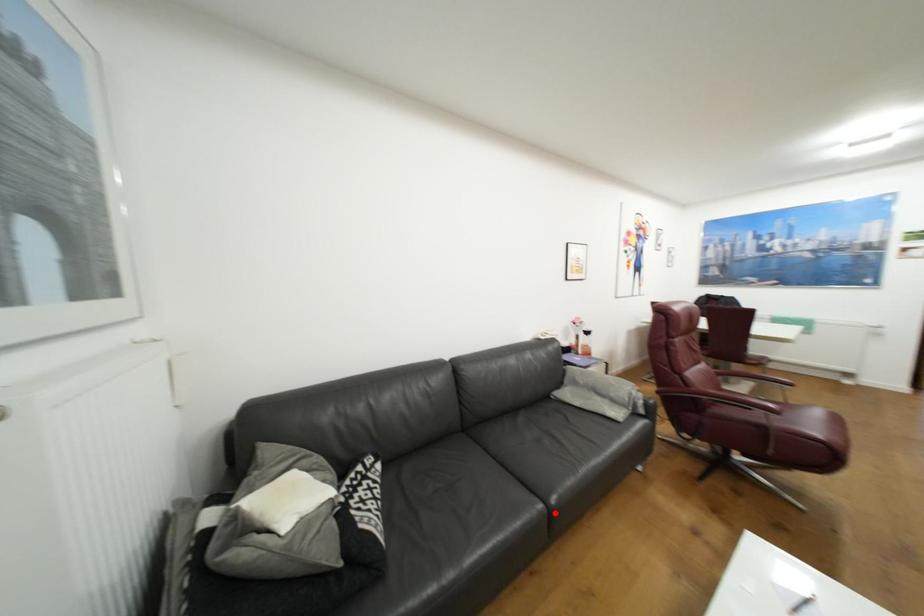
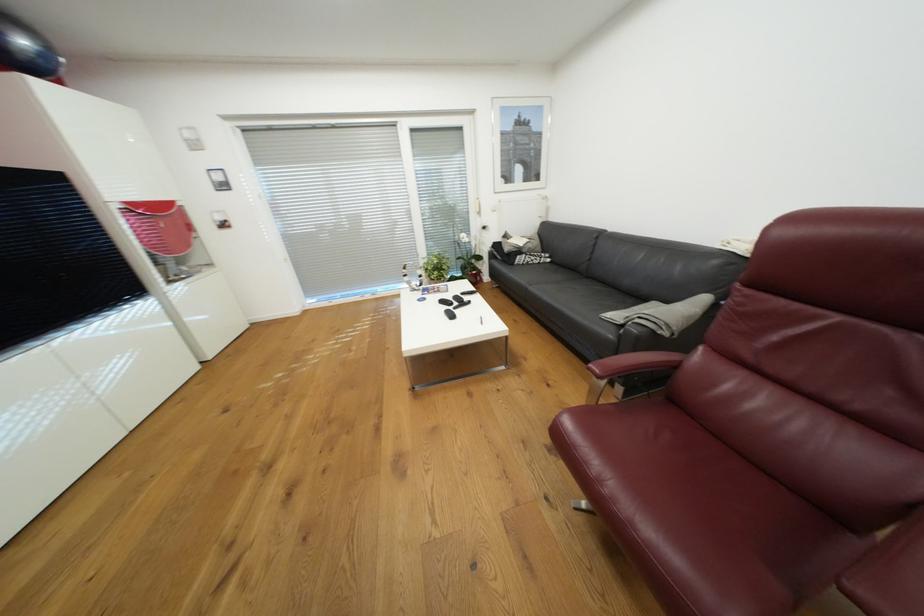
Find the pixel in the second image that matches the highlighted location in the first image.

(533, 289)